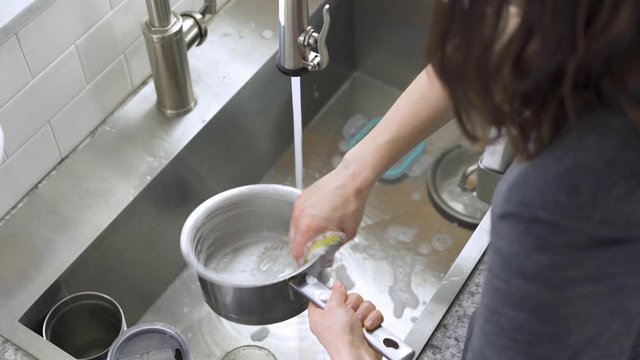
Locate an element on the screen. The height and width of the screenshot is (360, 640). hole in the handle of the pot is located at coordinates (390, 346).